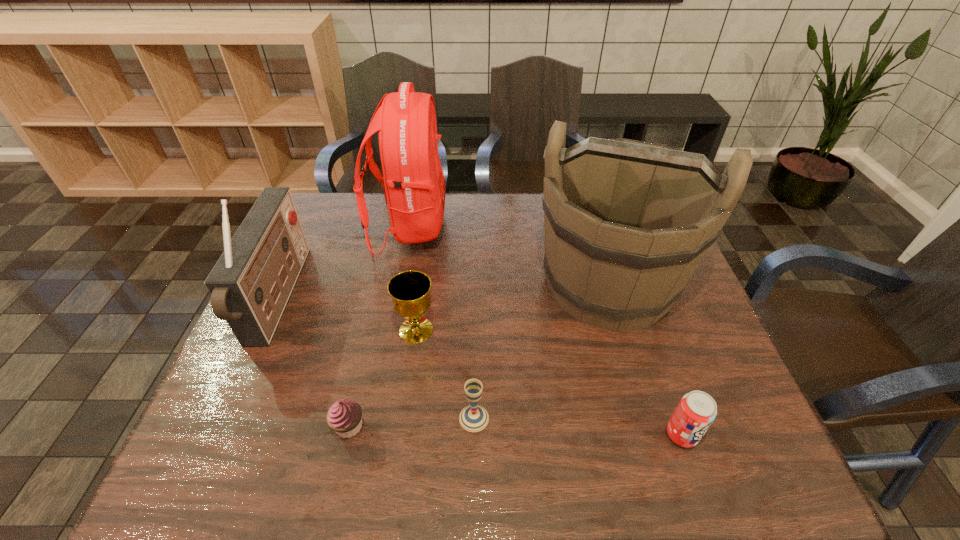
You are a GUI agent. You are given a task and a screenshot of the screen. Output one action in this format:
    pyautogui.click(x=<x>, y=<y>)
    Task: Click on the cupcake at the near edge
    Image resolution: width=960 pixels, height=540 pixels.
    Given the screenshot: What is the action you would take?
    (344, 417)

Locate an element on the screen. Image resolution: width=960 pixels, height=540 pixels. object located in the left edge section of the desktop is located at coordinates (250, 284).

Where is `bucket at the right edge`? This screenshot has width=960, height=540. bucket at the right edge is located at coordinates (626, 223).

At what (x,y) coordinates should I click in order to perform the action: click on soda can at the right edge. Please return your answer as a coordinate pair (x, y). This screenshot has width=960, height=540. Looking at the image, I should click on (697, 410).

Where is `object that is at the far right corner`? The width and height of the screenshot is (960, 540). object that is at the far right corner is located at coordinates (626, 223).

Find the location of a particular element. object located in the near right corner section of the desktop is located at coordinates (697, 410).

Locate an element on the screen. This screenshot has height=540, width=960. blank space at the far edge of the desktop is located at coordinates (476, 214).

This screenshot has height=540, width=960. Find the location of `blank space at the near edge of the desktop`. blank space at the near edge of the desktop is located at coordinates click(x=494, y=480).

Where is `vacant space at the left edge of the desktop`? This screenshot has width=960, height=540. vacant space at the left edge of the desktop is located at coordinates (276, 390).

Find the location of `vacant region at the right edge of the desktop`. vacant region at the right edge of the desktop is located at coordinates (669, 345).